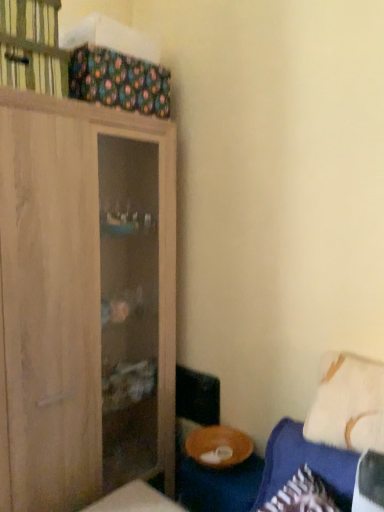
The image size is (384, 512). What are the coordinates of `blank space situated above wooden bowl at lower right (from a real-world perspective)` in the screenshot? It's located at (225, 465).